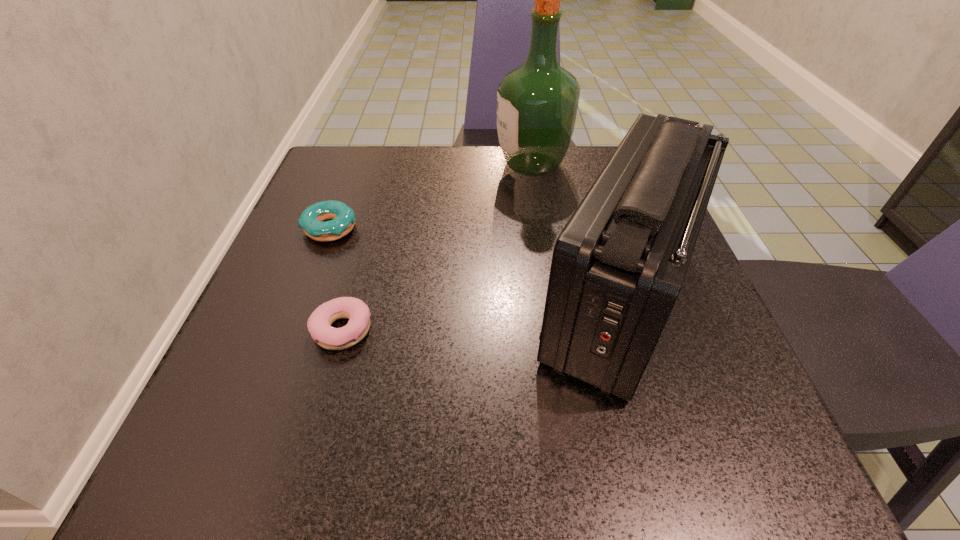
The width and height of the screenshot is (960, 540). Identify the location of blank space located 0.390m on the front panel of the radio receiver. (295, 301).

Where is `blank space located 0.120m on the right of the nearer doughnut`? This screenshot has width=960, height=540. blank space located 0.120m on the right of the nearer doughnut is located at coordinates (448, 330).

I want to click on vacant space located on the back of the farther doughnut, so click(361, 147).

Where is `object that is at the far edge`? This screenshot has height=540, width=960. object that is at the far edge is located at coordinates (537, 102).

The height and width of the screenshot is (540, 960). In order to click on object present at the right edge in this screenshot , I will do `click(618, 265)`.

I want to click on vacant region at the far edge of the desktop, so coord(463,165).

Locate an element on the screen. Image resolution: width=960 pixels, height=540 pixels. vacant space at the near edge is located at coordinates pyautogui.click(x=475, y=483).

Identify the location of free spot at the left edge of the desktop. (356, 252).

In the image, there is a desktop. Where is `free region at the right edge`? This screenshot has width=960, height=540. free region at the right edge is located at coordinates (705, 327).

The image size is (960, 540). In the image, there is a desktop. In order to click on free space at the far left corner in this screenshot , I will do `click(303, 204)`.